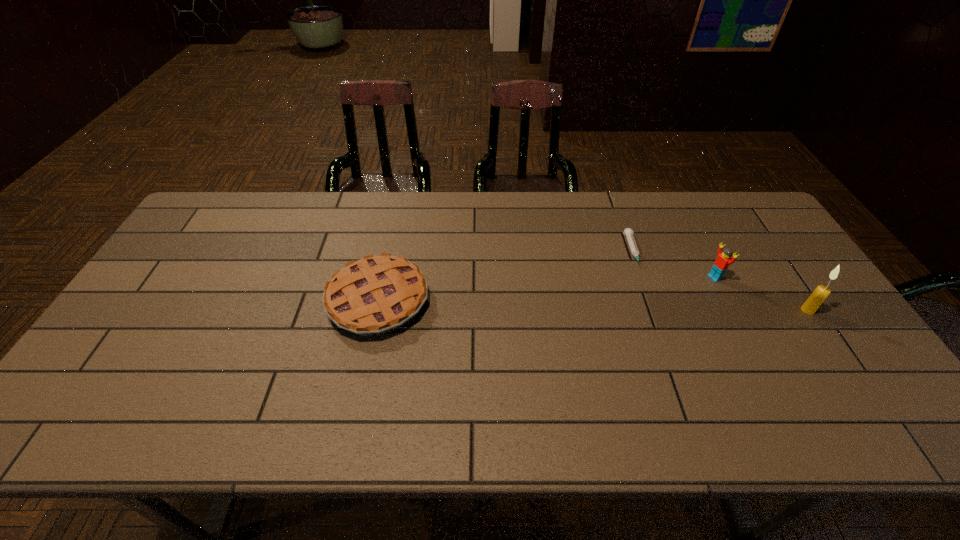
Image resolution: width=960 pixels, height=540 pixels. In the image, there is a desktop. What are the coordinates of `free region at the left edge` in the screenshot? It's located at (183, 274).

This screenshot has height=540, width=960. In the image, there is a desktop. What are the coordinates of `free region at the far left corner` in the screenshot? It's located at (199, 230).

This screenshot has height=540, width=960. I want to click on vacant space at the far right corner, so click(x=721, y=199).

Locate an element on the screen. Image resolution: width=960 pixels, height=540 pixels. vacant region between the third object from right to left and the third object from left to right is located at coordinates (674, 265).

Where is `vacant area that lies between the second object from left to right and the third tallest object`? This screenshot has height=540, width=960. vacant area that lies between the second object from left to right and the third tallest object is located at coordinates (506, 276).

Locate an element on the screen. vacant space that is in between the second object from right to left and the candle is located at coordinates (761, 294).

Locate an element on the screen. free spot between the rightmost object and the pie is located at coordinates (593, 306).

The width and height of the screenshot is (960, 540). I want to click on free space between the rightmost object and the second object from left to right, so click(720, 281).

I want to click on vacant space in between the rightmost object and the leftmost object, so click(x=593, y=306).

This screenshot has height=540, width=960. Identify the location of free space between the leftmost object and the rightmost object. (593, 306).